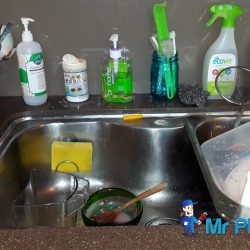
Image resolution: width=250 pixels, height=250 pixels. What are the coordinates of `wooden spoon` in the screenshot? It's located at (149, 193).